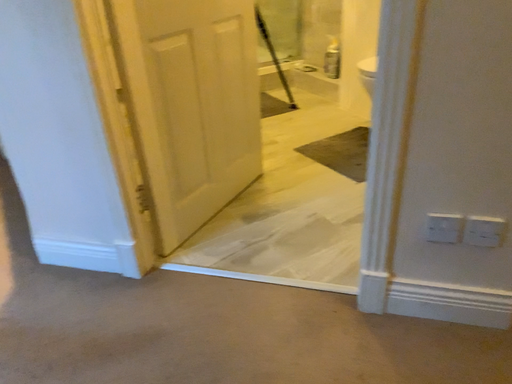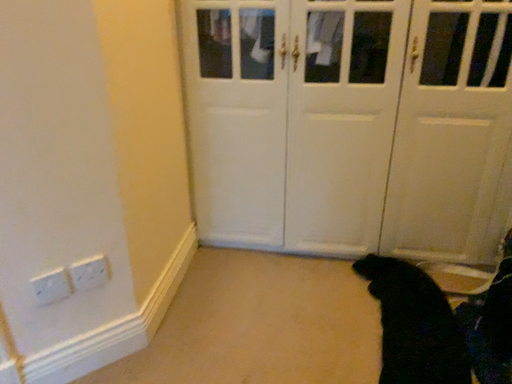
Question: How did the camera likely rotate when shooting the video?

Choices:
 (A) rotated right
 (B) rotated left

Answer: (A)